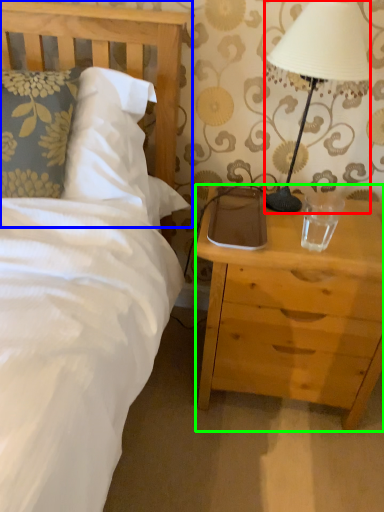
Question: Which object is positioned closest to lamp (highlighted by a red box)? Select from headboard (highlighted by a blue box) and nightstand (highlighted by a green box).

Choices:
 (A) headboard
 (B) nightstand

Answer: (B)